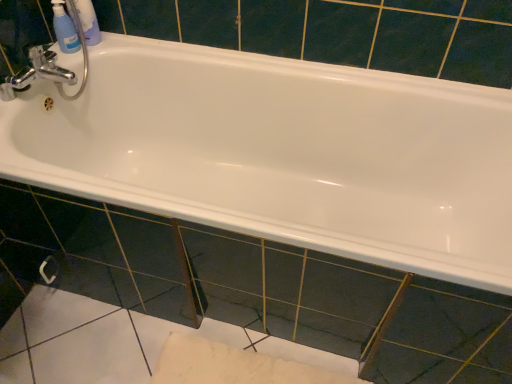
Where is `blank space situated above glossy ceramic tile at center (from a real-world perspective)`? blank space situated above glossy ceramic tile at center (from a real-world perspective) is located at coordinates (237, 222).